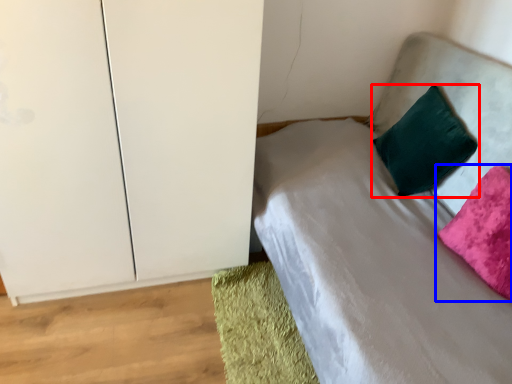
Question: Among these objects, which one is farthest to the camera, pillow (highlighted by a red box) or pillow (highlighted by a blue box)?

Choices:
 (A) pillow
 (B) pillow

Answer: (A)